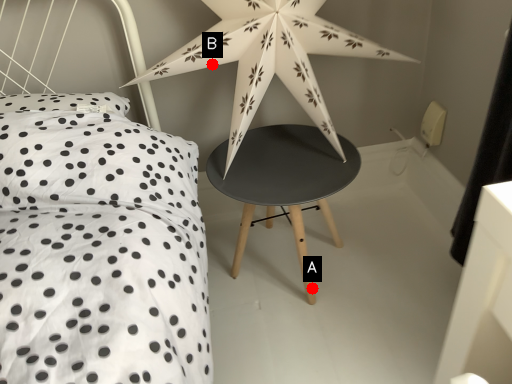
Question: Two points are circled on the image, labeled by A and B beside each circle. Which of the following is the farthest from the observer?

Choices:
 (A) A is further
 (B) B is further

Answer: (A)